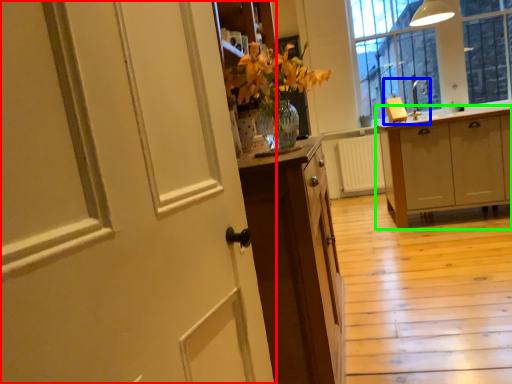
Question: Considering the real-world distances, which object is farthest from door (highlighted by a red box)? sink (highlighted by a blue box) or cabinetry (highlighted by a green box)?

Choices:
 (A) sink
 (B) cabinetry

Answer: (A)